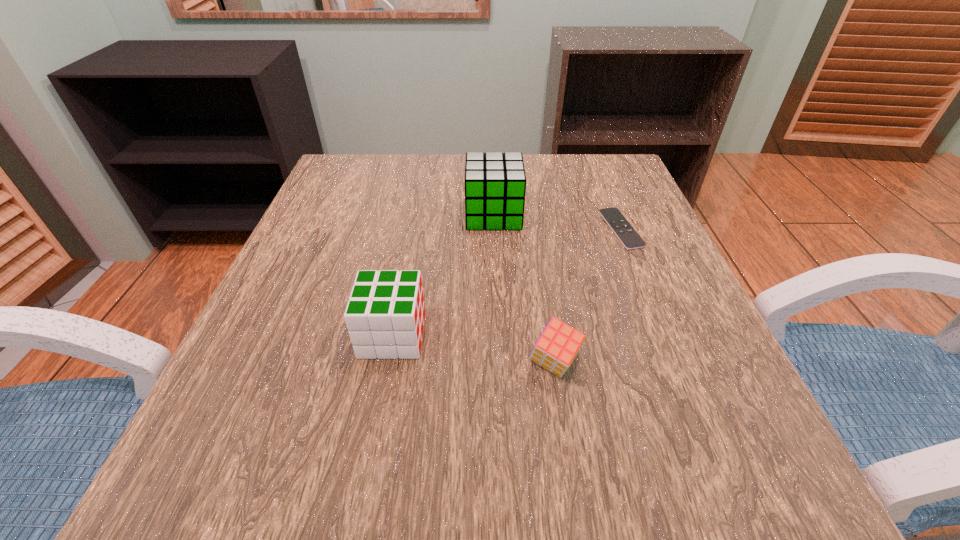
Identify the location of the tallest cube. Image resolution: width=960 pixels, height=540 pixels. (495, 183).

You are a GUI agent. You are given a task and a screenshot of the screen. Output one action in this format:
    pyautogui.click(x=<x>, y=<y>)
    Task: Click on the tallest object
    This screenshot has width=960, height=540.
    Given the screenshot: What is the action you would take?
    pyautogui.click(x=495, y=183)

Identify the location of the leftmost object. The width and height of the screenshot is (960, 540). (385, 314).

At what (x,y) coordinates should I click in order to perform the action: click on the leftmost cube. Please return your answer as a coordinate pair (x, y). This screenshot has width=960, height=540. Looking at the image, I should click on (385, 314).

Locate an element on the screen. The width and height of the screenshot is (960, 540). the shortest cube is located at coordinates (558, 345).

The width and height of the screenshot is (960, 540). I want to click on remote control, so click(x=627, y=235).

The image size is (960, 540). I want to click on the shortest object, so click(x=627, y=235).

Locate an element on the screen. Image resolution: width=960 pixels, height=540 pixels. vacant area located 0.220m on the left of the tallest cube is located at coordinates (365, 215).

Identify the location of vacant area located 0.110m on the red face of the third shortest object. The image size is (960, 540). (492, 335).

You are a GUI agent. You are given a task and a screenshot of the screen. Output one action in this format:
    pyautogui.click(x=<x>, y=<y>)
    Task: Click on the vacant space located on the right of the shortest cube
    
    Given the screenshot: What is the action you would take?
    pyautogui.click(x=646, y=363)